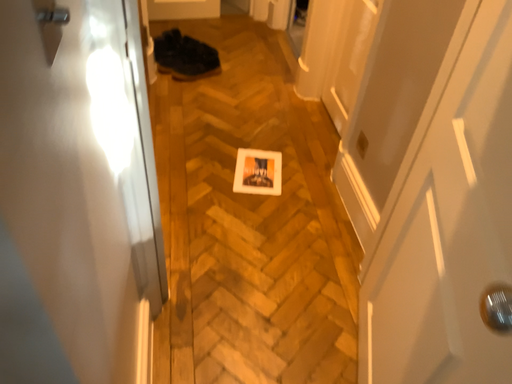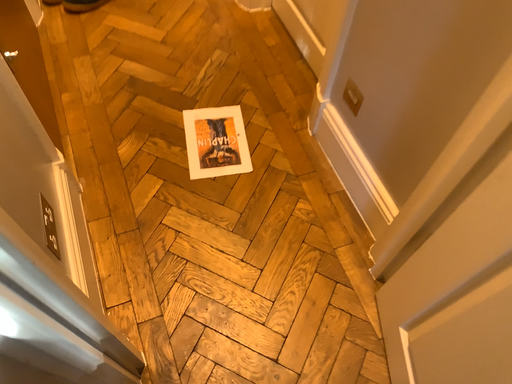
Question: Which way did the camera rotate in the video?

Choices:
 (A) rotated left
 (B) rotated right

Answer: (B)